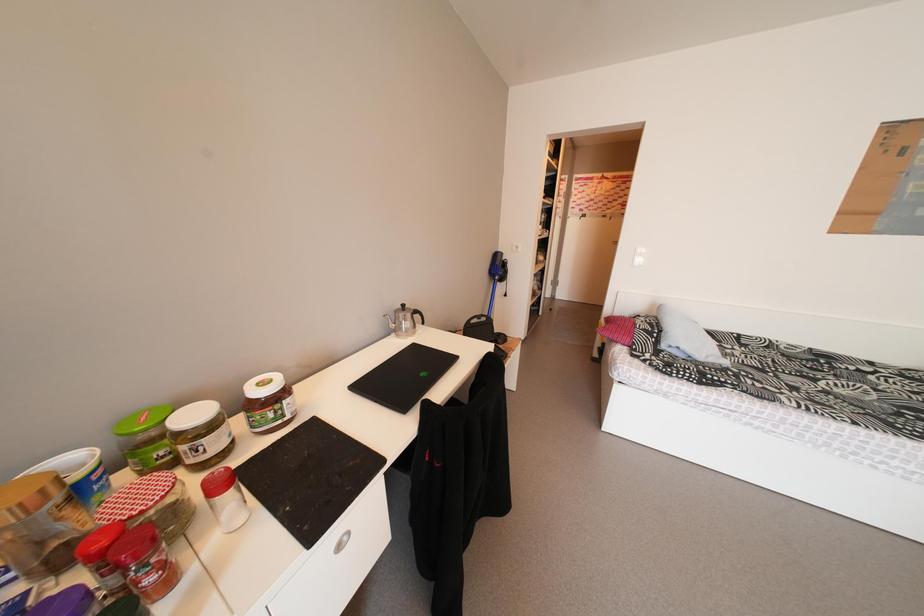
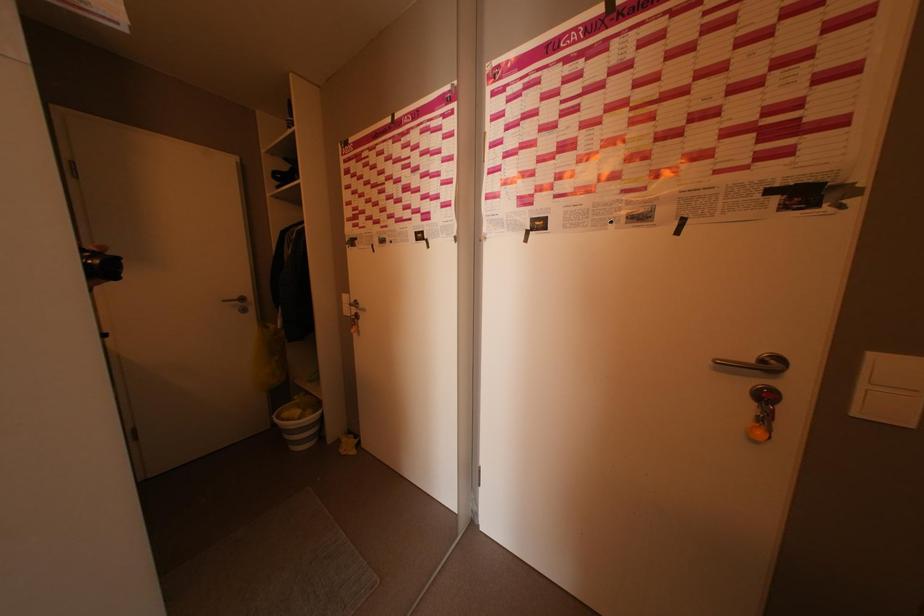
In a continuous first-person perspective shot, in which direction is the camera moving?

The cameraman walked toward right, forward.